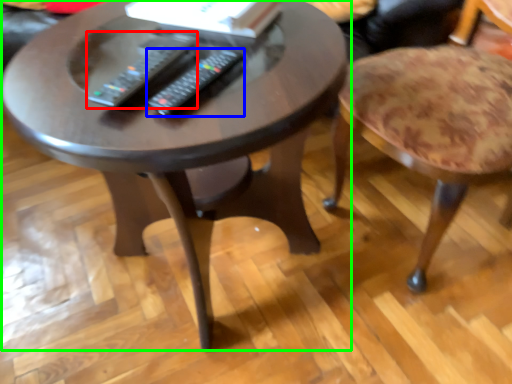
Question: Which is nearer to the remote (highlighted by a red box)? remote (highlighted by a blue box) or coffee table (highlighted by a green box).

Choices:
 (A) remote
 (B) coffee table

Answer: (A)